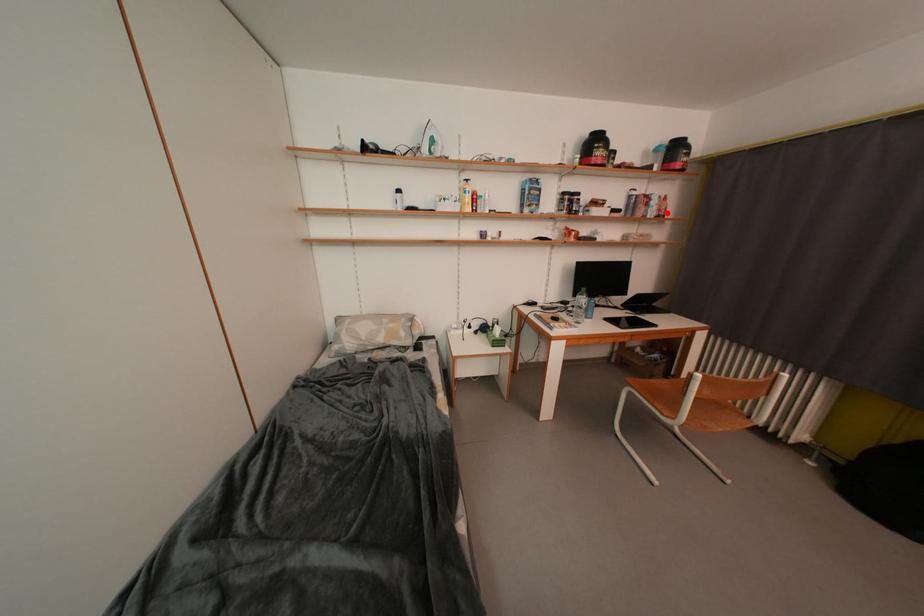
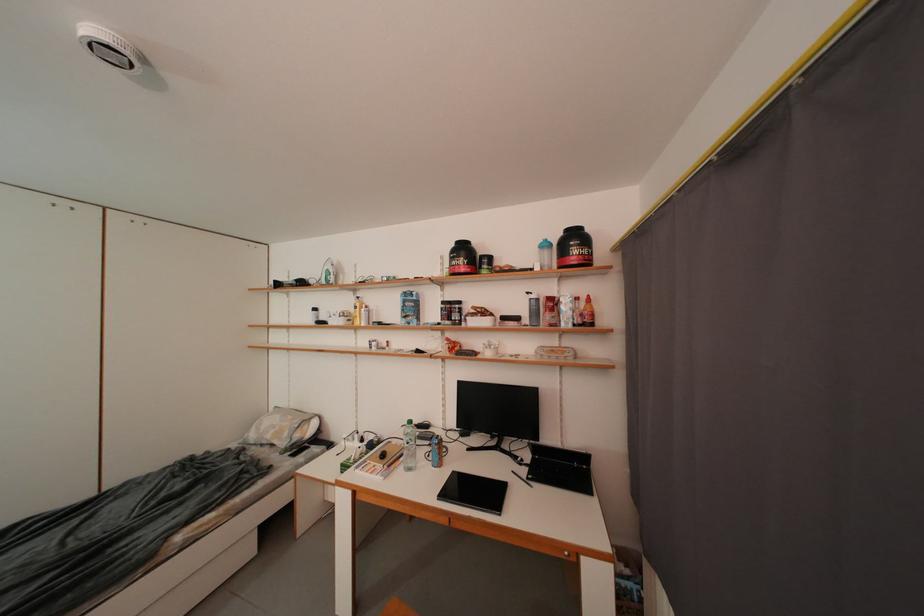
Locate, in the second image, the point that corresponds to the highlighted location in the first image.

(590, 318)